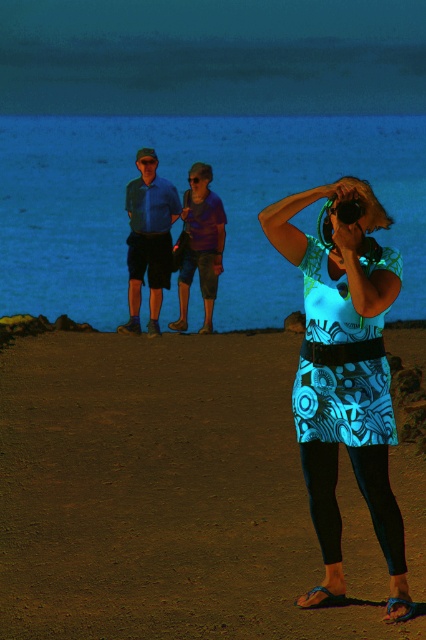
Question: Is blue printed skirt at center to the right of blue water at upper center from the viewer's perspective?

Choices:
 (A) no
 (B) yes

Answer: (B)

Question: Which point appears closest to the camera in this image?

Choices:
 (A) (339, 394)
 (B) (126, 518)

Answer: (A)

Question: Which point is closer to the camera taking this photo?

Choices:
 (A) (184, 240)
 (B) (259, 252)

Answer: (A)

Question: Is blue printed skirt at center behind blue water at upper center?

Choices:
 (A) yes
 (B) no

Answer: (B)

Question: Which object is closer to the camera taking this photo?

Choices:
 (A) purple cotton shirt at center
 (B) blue cotton shirt at center
 (C) blue water at upper center
 (D) patterned fabric dress at center

Answer: (D)

Question: Does patterned fabric dress at center have a greater width compared to blue cotton shirt at center?

Choices:
 (A) yes
 (B) no

Answer: (A)